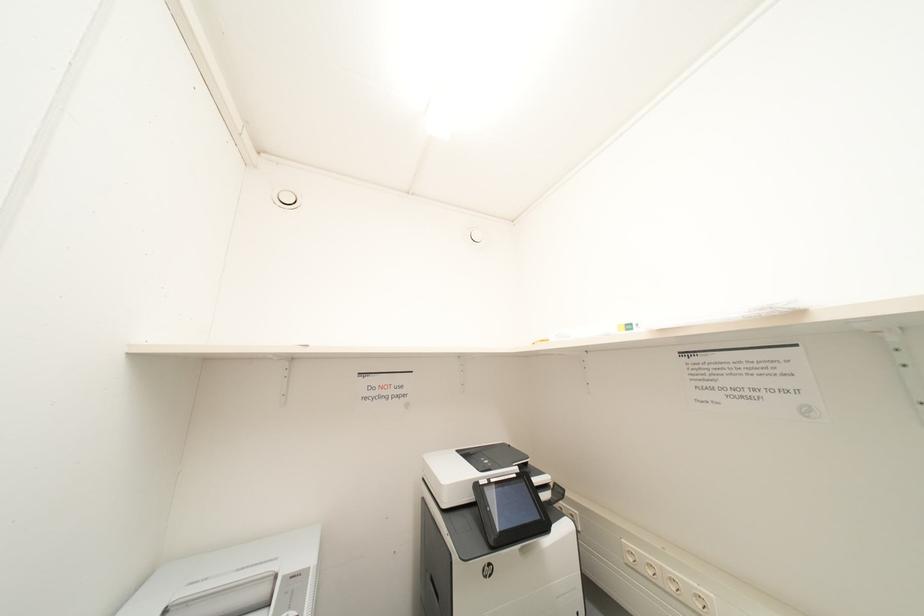
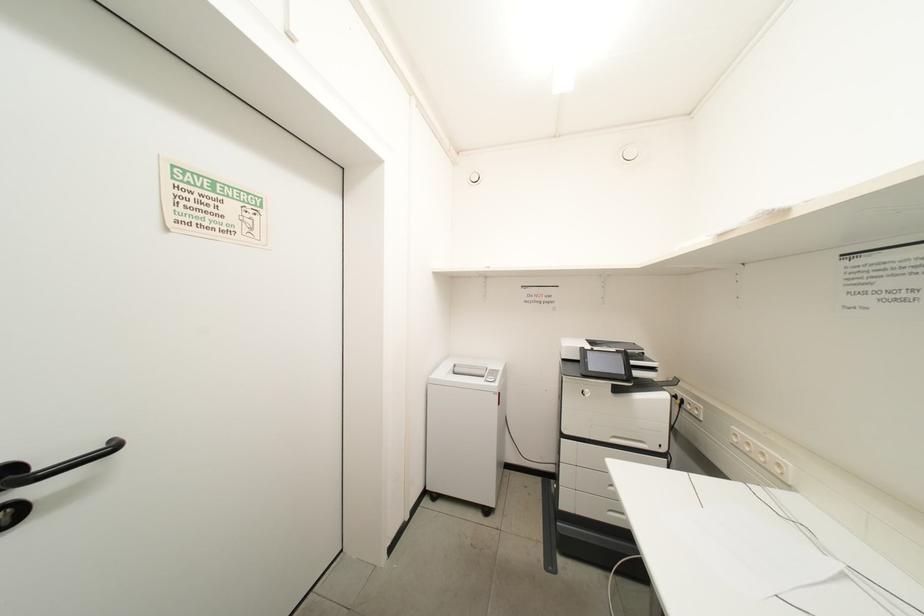
Question: The camera is either moving clockwise (left) or counter-clockwise (right) around the object. The first image is from the beginning of the video and the second image is from the end. Is the camera moving left or right when shooting the video?

Choices:
 (A) Left
 (B) Right

Answer: (B)